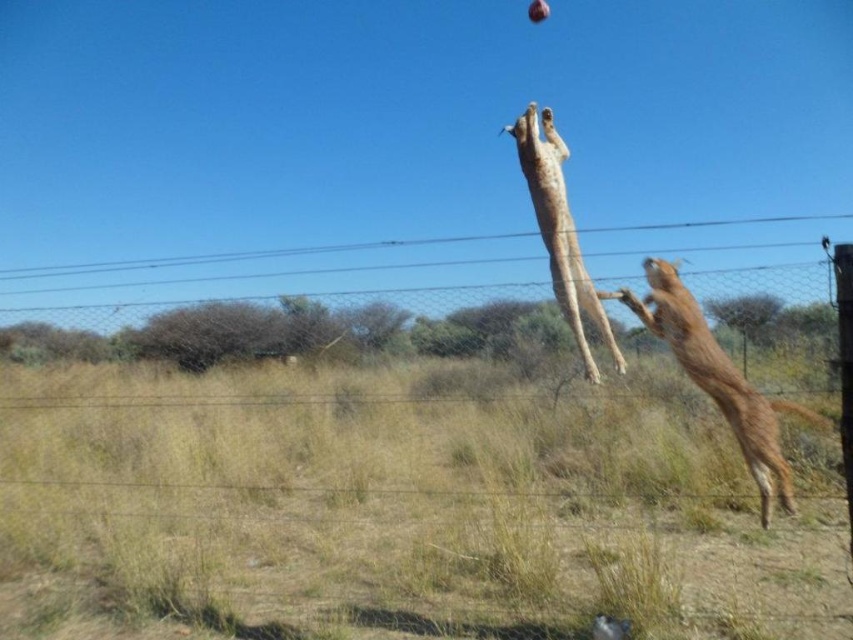
You are a photographer standing at the camera position. You want to place a small marker at point [15,346] so that it can be seen clearly in the photo. Considering the distance between the camera and the point, will the marker be in focus if your camera is set to auto focus with a depth of field of 5 meters?

The distance between the camera and point [15,346] is 6.75 meters. Since the depth of field is 5 meters, the marker at point [15,346] will be outside the depth of field range. Therefore, the marker may not be in focus automatically. Adjust the focus manually or increase the depth of field setting for better clarity.

You are a photographer trying to capture a photo of the brown furry dog at upper right. You are currently standing behind the wire mesh fence at center. Which direction should you move to get a better shot of the dog?

Since the wire mesh fence at center is to the left of the brown furry dog at upper right, you should move to the right side of the wire mesh fence at center to position yourself closer to the dog and get a better shot.

You are a photographer aiming to capture a clear shot of the golden fur dog at center without the wire mesh fence at center obstructing the view. Based on their positions, is this possible?

The wire mesh fence at center is positioned under the golden fur dog at center, so the dog is above the fence. This means the photographer can capture a clear shot of the golden fur dog at center without the fence obstructing the view since the dog is elevated above it.